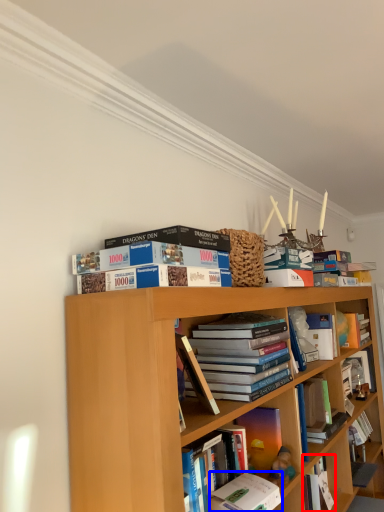
Question: Which point is closer to the camera, book (highlighted by a red box) or book (highlighted by a blue box)?

Choices:
 (A) book
 (B) book

Answer: (B)